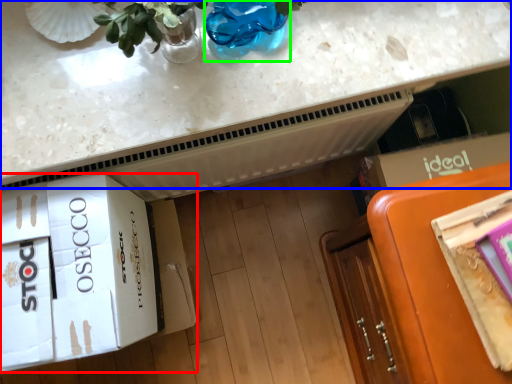
Question: Estimate the real-world distances between objects in this image. Which object is farther from cardboard box (highlighted by a red box), countertop (highlighted by a blue box) or glass vase (highlighted by a green box)?

Choices:
 (A) countertop
 (B) glass vase

Answer: (B)